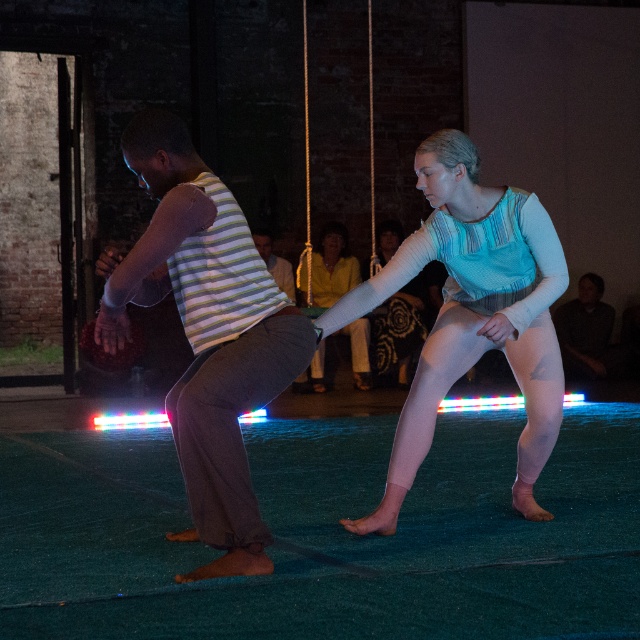
You are a photographer standing at the center of the scene. You want to capture a photo that includes both the matte blue fabric at center and the dark gray sweater at center. Given the distance between them, will you need to adjust your camera to a wider angle to ensure both are in frame?

The distance between the matte blue fabric at center and the dark gray sweater at center is 8.21 meters. To capture both in a single frame, you would need to use a wider angle lens to accommodate the significant distance between them.